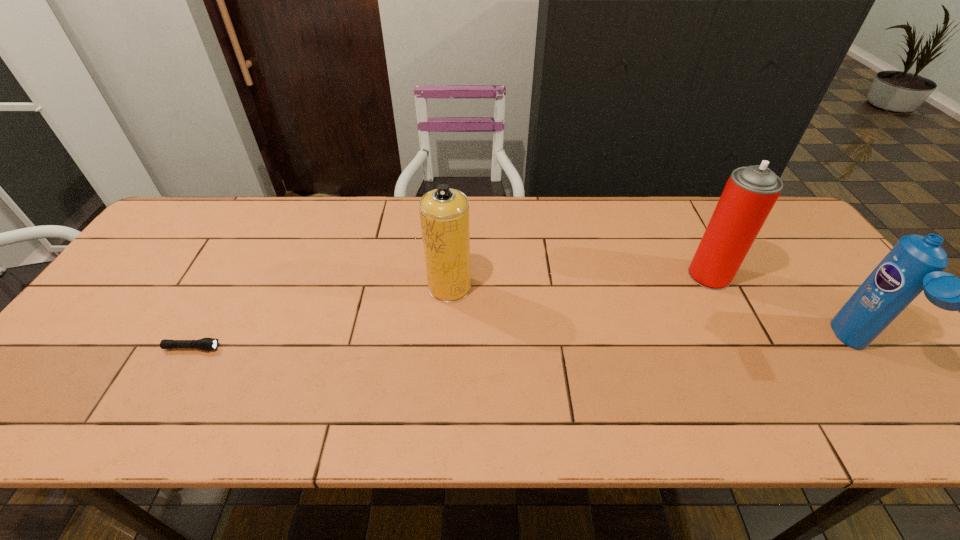
You are a GUI agent. You are given a task and a screenshot of the screen. Output one action in this format:
    pyautogui.click(x=<x>, y=<y>)
    Task: Click on the right aerosol can
    
    Given the screenshot: What is the action you would take?
    click(x=750, y=193)

This screenshot has height=540, width=960. What are the coordinates of `the left aerosol can` in the screenshot? It's located at (444, 212).

Find the location of a particular element. Image resolution: width=960 pixels, height=540 pixels. the rightmost object is located at coordinates (915, 263).

Where is `the shortest object`? the shortest object is located at coordinates (207, 344).

Identify the location of the leftmost object. This screenshot has height=540, width=960. (207, 344).

Find the location of a particular element. The width and height of the screenshot is (960, 540). free spot located 0.230m on the left of the right aerosol can is located at coordinates (606, 275).

You are a GUI agent. You are given a task and a screenshot of the screen. Output one action in this format:
    pyautogui.click(x=<x>, y=<y>)
    Task: Click on the free space located on the left of the second object from left to right
    Image resolution: width=960 pixels, height=540 pixels.
    Given the screenshot: What is the action you would take?
    [x=370, y=287]

Where is `vacant space positioned 0.200m on the back of the shampoo`? This screenshot has height=540, width=960. vacant space positioned 0.200m on the back of the shampoo is located at coordinates (796, 265).

I want to click on vacant region located 0.140m at the lens end of the leftmost object, so click(277, 348).

Identify the location of object present at the right edge. This screenshot has height=540, width=960. (915, 263).